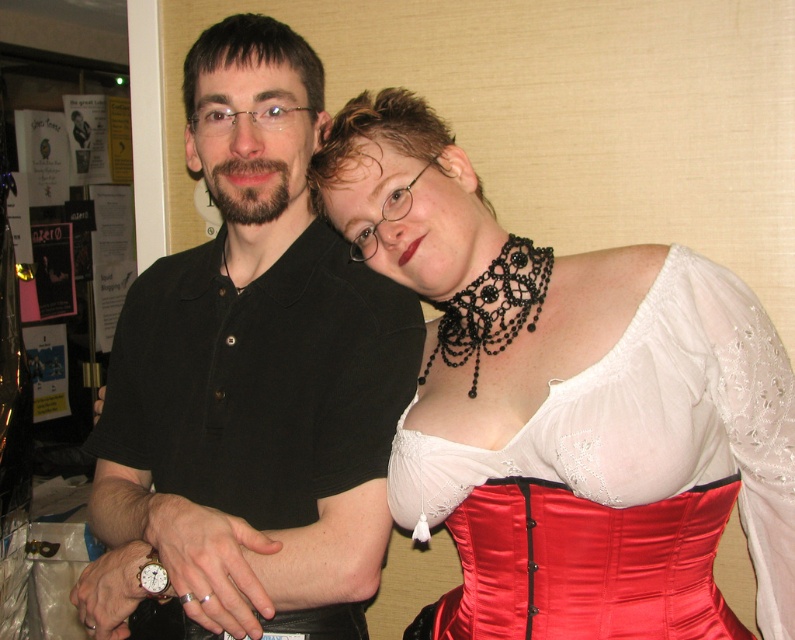
Question: Which of the following is the closest to the observer?

Choices:
 (A) (786, 392)
 (B) (152, 442)

Answer: (A)

Question: Does black matte shirt at center have a greater width compared to satin red corset at center?

Choices:
 (A) yes
 (B) no

Answer: (B)

Question: From the image, what is the correct spatial relationship of black matte shirt at center in relation to satin red corset at center?

Choices:
 (A) below
 (B) above

Answer: (B)

Question: Which object appears farthest from the camera in this image?

Choices:
 (A) satin red corset at center
 (B) black matte shirt at center

Answer: (B)

Question: From the image, what is the correct spatial relationship of black matte shirt at center in relation to satin red corset at center?

Choices:
 (A) right
 (B) left

Answer: (B)